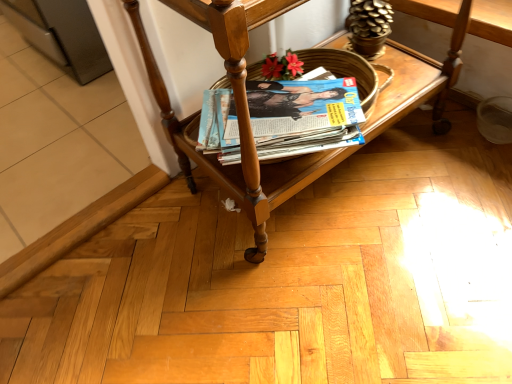
Question: From their relative heights in the image, would you say matte paper magazine at center is taller or shorter than wooden magazine rack at center?

Choices:
 (A) short
 (B) tall

Answer: (A)

Question: Looking at their shapes, would you say matte paper magazine at center is wider or thinner than wooden magazine rack at center?

Choices:
 (A) wide
 (B) thin

Answer: (B)

Question: Does point (214, 150) appear closer or farther from the camera than point (231, 69)?

Choices:
 (A) farther
 (B) closer

Answer: (A)

Question: Based on their positions, is wooden magazine rack at center located to the left or right of matte paper magazine at center?

Choices:
 (A) right
 (B) left

Answer: (A)

Question: Is point (226, 8) closer or farther from the camera than point (271, 114)?

Choices:
 (A) farther
 (B) closer

Answer: (B)

Question: Is wooden magazine rack at center inside the boundaries of matte paper magazine at center, or outside?

Choices:
 (A) inside
 (B) outside

Answer: (B)

Question: From the image's perspective, relative to matte paper magazine at center, is wooden magazine rack at center above or below?

Choices:
 (A) above
 (B) below

Answer: (A)